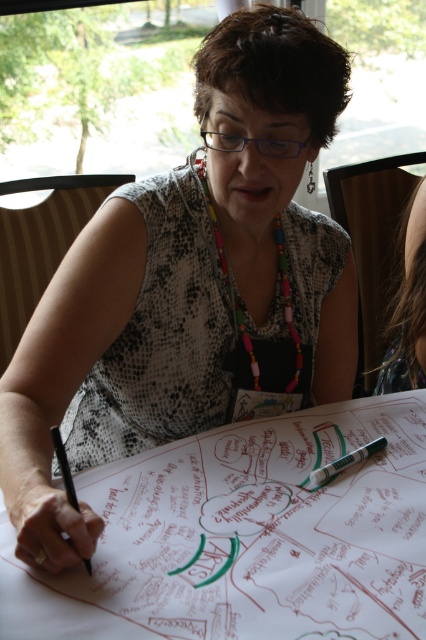
Which is above, white paper at center or black matte pen at lower left?

black matte pen at lower left

Is white paper at center closer to the viewer compared to black matte pen at lower left?

That is True.

Between point (74, 620) and point (86, 566), which one is positioned in front?

Point (74, 620) is in front.

I want to click on white paper at center, so click(x=247, y=536).

Does green matte marker at center have a lesser width compared to black matte pen at lower left?

In fact, green matte marker at center might be wider than black matte pen at lower left.

Does point (370, 444) come farther from viewer compared to point (89, 573)?

Yes, it is.

Which is behind, point (362, 448) or point (65, 461)?

Point (362, 448)

Identify the location of green matte marker at center. (345, 461).

Looking at this image, between dark brown hair at upper right and green matte marker at center, which one is positioned higher?

dark brown hair at upper right is higher up.

Between dark brown hair at upper right and green matte marker at center, which one is positioned lower?

Positioned lower is green matte marker at center.

Between point (394, 378) and point (336, 467), which one is positioned behind?

The point (394, 378) is more distant.

At what (x,y) coordinates should I click in order to perform the action: click on dark brown hair at upper right. Please return your answer as a coordinate pair (x, y). This screenshot has width=426, height=640. Looking at the image, I should click on (408, 307).